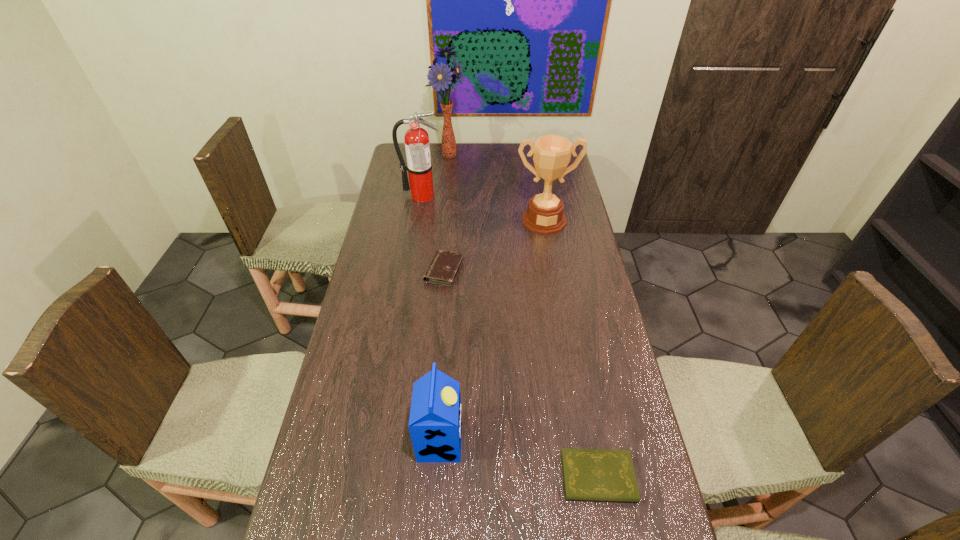
You are a GUI agent. You are given a task and a screenshot of the screen. Output one action in this format:
    pyautogui.click(x=<x>, y=<y>)
    Task: Click on the free space at the left edge of the desktop
    
    Given the screenshot: What is the action you would take?
    pyautogui.click(x=316, y=477)

Locate an element on the screen. The height and width of the screenshot is (540, 960). free region at the right edge is located at coordinates (591, 355).

You are a GUI agent. You are given a task and a screenshot of the screen. Output one action in this format:
    pyautogui.click(x=<x>, y=<y>)
    Task: Click on the vacant point located between the shorter diary and the fourth tallest object
    The height and width of the screenshot is (540, 960).
    Given the screenshot: What is the action you would take?
    pyautogui.click(x=519, y=459)

What are the coordinates of `vacant area that lies between the award and the carton` in the screenshot? It's located at (492, 331).

Find the location of a particular element. free space between the shorter diary and the carton is located at coordinates (519, 459).

This screenshot has width=960, height=540. Identify the location of empty space that is in between the carton and the fifth nearest object. (431, 318).

You are a GUI agent. You are given a task and a screenshot of the screen. Output one action in this format:
    pyautogui.click(x=<x>, y=<y>)
    Task: Click on the vacant space that is in between the award and the farthest object
    Image resolution: width=960 pixels, height=540 pixels.
    Given the screenshot: What is the action you would take?
    pos(496,187)

Locate an element on the screen. Image resolution: width=960 pixels, height=540 pixels. vacant area that lies between the nearer diary and the fire extinguisher is located at coordinates (510, 336).

Find the location of a particular element. The width and height of the screenshot is (960, 540). vacant point located between the fire extinguisher and the flower arrangement is located at coordinates (435, 175).

The width and height of the screenshot is (960, 540). I want to click on unoccupied position between the second farthest object and the third nearest object, so click(x=433, y=233).